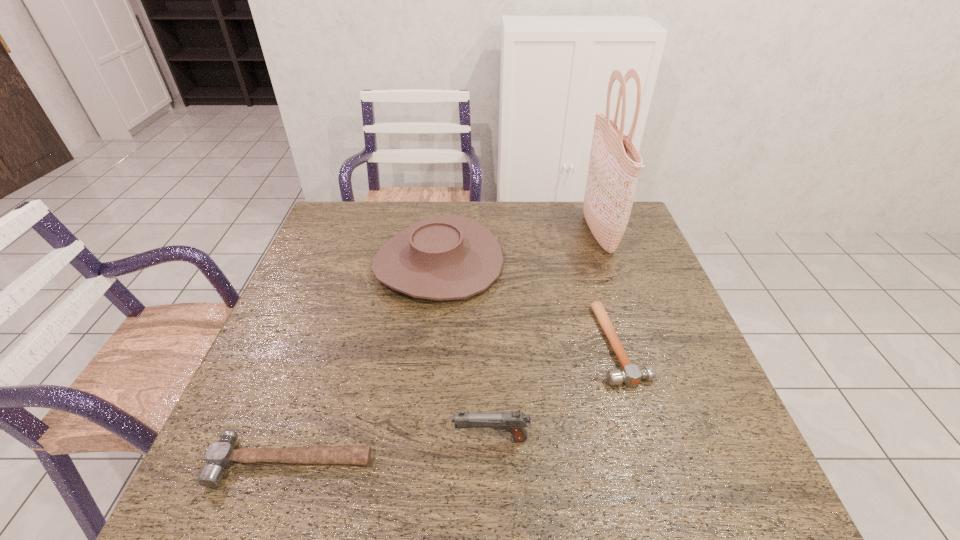
Locate an element on the screen. The height and width of the screenshot is (540, 960). the tallest object is located at coordinates (614, 166).

Locate an element on the screen. cowboy hat is located at coordinates (449, 257).

Where is `gun`? The width and height of the screenshot is (960, 540). gun is located at coordinates (514, 422).

Identify the location of the nearer hammer. (221, 454).

Find the location of `the right hammer`. the right hammer is located at coordinates (631, 375).

I want to click on vacant region located 0.330m on the front of the tallest object, so click(x=643, y=359).

Find the location of a particular element. Image resolution: width=960 pixels, height=540 pixels. blank area located 0.110m on the front of the cowboy hat is located at coordinates (429, 341).

Locate an element on the screen. The width and height of the screenshot is (960, 540). vacant space located 0.350m in the direction the gun is aimed is located at coordinates (279, 439).

This screenshot has width=960, height=540. Identify the location of free space located in the direction the gun is aimed. [x=414, y=439].

I want to click on vacant space located in the direction the gun is aimed, so click(x=344, y=439).